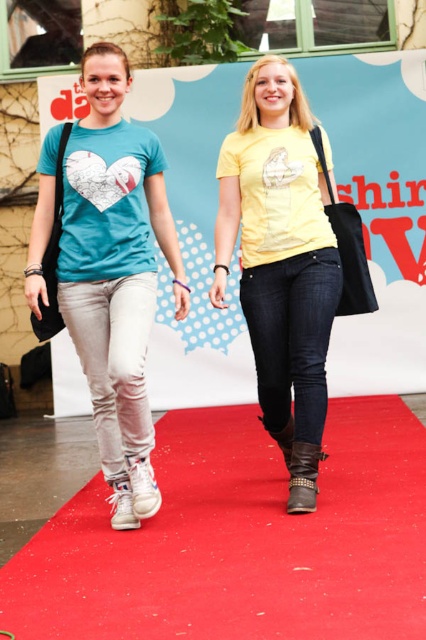
Is red carpet at center thinner than yellow matte t-shirt at center?

In fact, red carpet at center might be wider than yellow matte t-shirt at center.

Can you confirm if red carpet at center is wider than yellow matte t-shirt at center?

Yes.

Is point (273, 506) behind point (316, 160)?

No, (273, 506) is in front of (316, 160).

Image resolution: width=426 pixels, height=640 pixels. I want to click on red carpet at center, so click(x=241, y=540).

Measure the distance from yellow matte t-shirt at center to leather studded boot at center.

yellow matte t-shirt at center and leather studded boot at center are 31.68 inches apart from each other.

Is yellow matte t-shirt at center positioned behind leather studded boot at center?

That is True.

Locate an element on the screen. The image size is (426, 640). yellow matte t-shirt at center is located at coordinates (279, 250).

Does red carpet at center have a lesser height compared to white leather boot at lower left?

Incorrect, red carpet at center's height does not fall short of white leather boot at lower left's.

Can you confirm if red carpet at center is thinner than white leather boot at lower left?

Incorrect, red carpet at center's width is not less than white leather boot at lower left's.

Find the location of `red carpet at center`. red carpet at center is located at coordinates (241, 540).

Locate an element on the screen. red carpet at center is located at coordinates point(241,540).